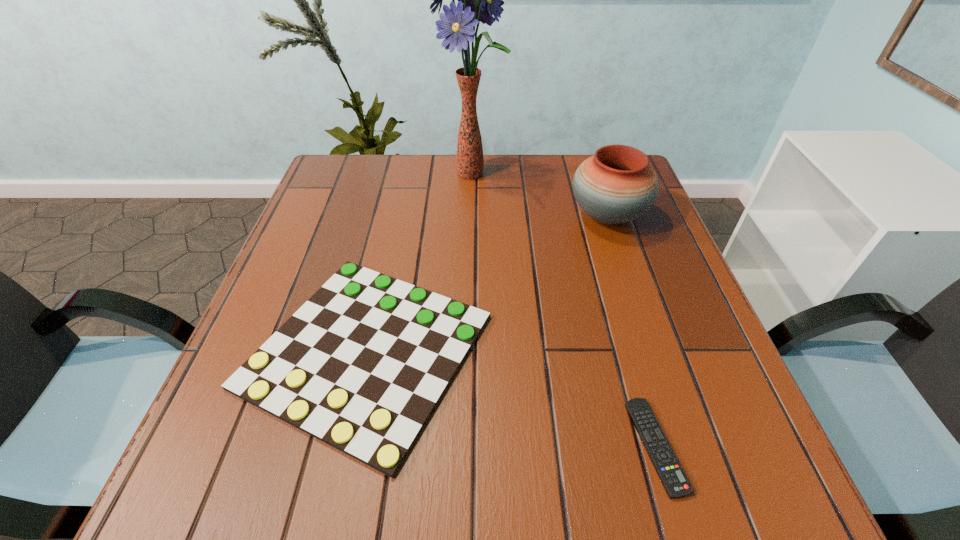
The width and height of the screenshot is (960, 540). Find the location of `checkerboard at the near edge`. checkerboard at the near edge is located at coordinates (361, 365).

The image size is (960, 540). Find the location of `remote control situated at the near edge`. remote control situated at the near edge is located at coordinates (671, 474).

Locate an element on the screen. The width and height of the screenshot is (960, 540). object positioned at the left edge is located at coordinates (361, 365).

The width and height of the screenshot is (960, 540). I want to click on pottery present at the right edge, so click(616, 185).

Find the location of `remote control that is at the right edge`. remote control that is at the right edge is located at coordinates (671, 474).

I want to click on object that is at the near left corner, so click(361, 365).

At what (x,y) coordinates should I click in order to perform the action: click on object present at the far right corner. Please return your answer as a coordinate pair (x, y). Looking at the image, I should click on (616, 185).

This screenshot has width=960, height=540. What are the coordinates of `object at the near right corner` in the screenshot? It's located at (671, 474).

In the image, there is a desktop. At what (x,y) coordinates should I click in order to perform the action: click on vacant space at the far edge. Please return your answer as a coordinate pair (x, y). Looking at the image, I should click on (516, 154).

Image resolution: width=960 pixels, height=540 pixels. I want to click on blank space at the near edge of the desktop, so click(352, 504).